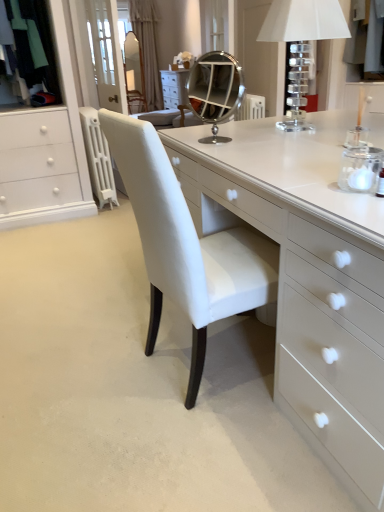
Question: From the image's perspective, is gray fabric coat at upper right above or below matte glass mirror at upper center, the 2th mirror from the right?

Choices:
 (A) above
 (B) below

Answer: (B)

Question: From a real-world perspective, relative to matte glass mirror at upper center, positioned as the 2th mirror in bottom-to-top order, is gray fabric coat at upper right vertically above or below?

Choices:
 (A) above
 (B) below

Answer: (A)

Question: Which object is the closest to the white textured curtain at upper center?

Choices:
 (A) white glossy table at center
 (B) clear acrylic table lamp at upper right
 (C) gray fabric coat at upper right
 (D) silver/metallic mirror at center, the first mirror from the front
 (E) matte glass mirror at upper center, the 2th mirror when ordered from front to back

Answer: (E)

Question: Estimate the real-world distances between objects in this image. Which object is farther from the gray fabric coat at upper right?

Choices:
 (A) silver/metallic mirror at center, which appears as the first mirror when viewed from the right
 (B) white textured curtain at upper center
 (C) matte glass mirror at upper center, positioned as the 2th mirror in bottom-to-top order
 (D) clear acrylic table lamp at upper right
 (E) white glossy table at center

Answer: (C)